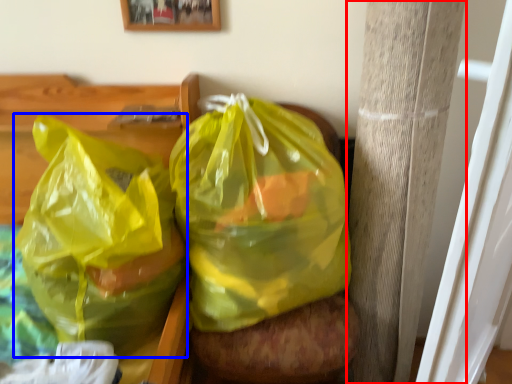
Question: Which object appears closest to the camera in this image, pillar (highlighted by a red box) or plastic bag (highlighted by a blue box)?

Choices:
 (A) pillar
 (B) plastic bag

Answer: (B)